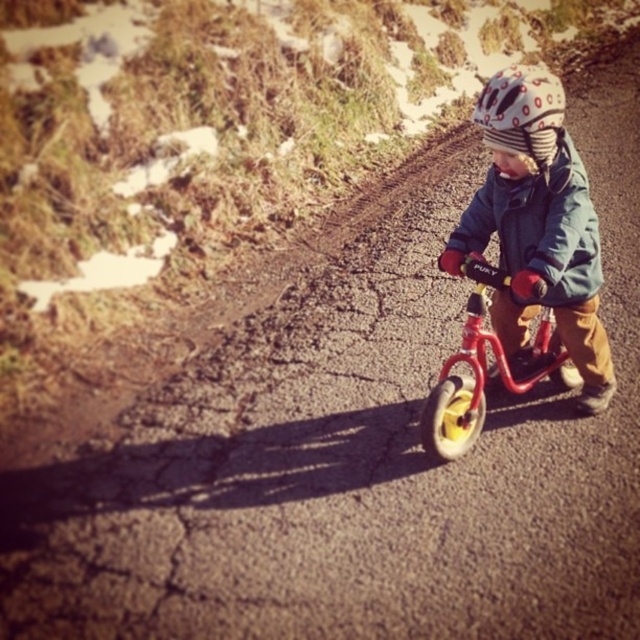
You are a photographer trying to capture the child riding the bicycle. You want to ensure the matte blue jacket at center and the white dotted helmet at center are both clearly visible. Based on their sizes, which object should you focus on to ensure both are in frame?

The matte blue jacket at center is taller than the white dotted helmet at center, so focusing on the taller matte blue jacket at center will help ensure both are in frame.

You are a photographer trying to capture the child riding the bicycle. You need to ensure that both the matte blue jacket at center and the white dotted helmet at center are clearly visible in your shot. Given that your camera has a depth of field that can focus on objects within a 20 inch range, will both items be in focus?

The matte blue jacket at center is 19.26 inches from the white dotted helmet at center. Since the distance between them is within the 20 inch range of the camera, both items will be in focus.